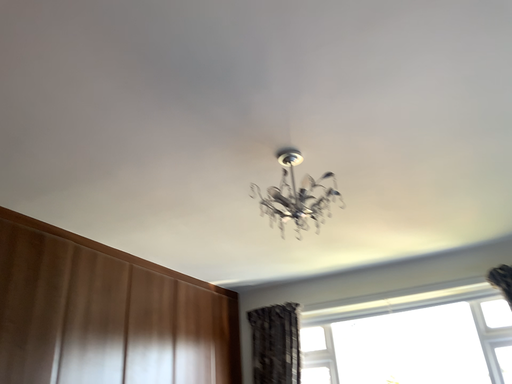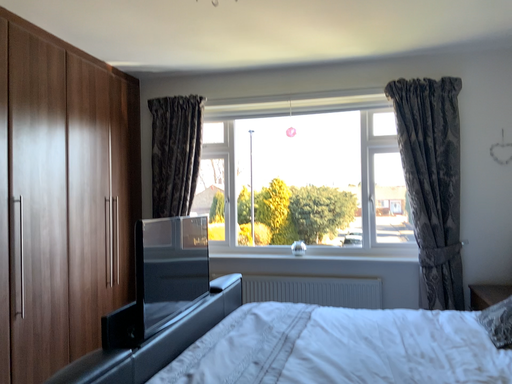
Question: How did the camera likely rotate when shooting the video?

Choices:
 (A) rotated left
 (B) rotated right

Answer: (B)